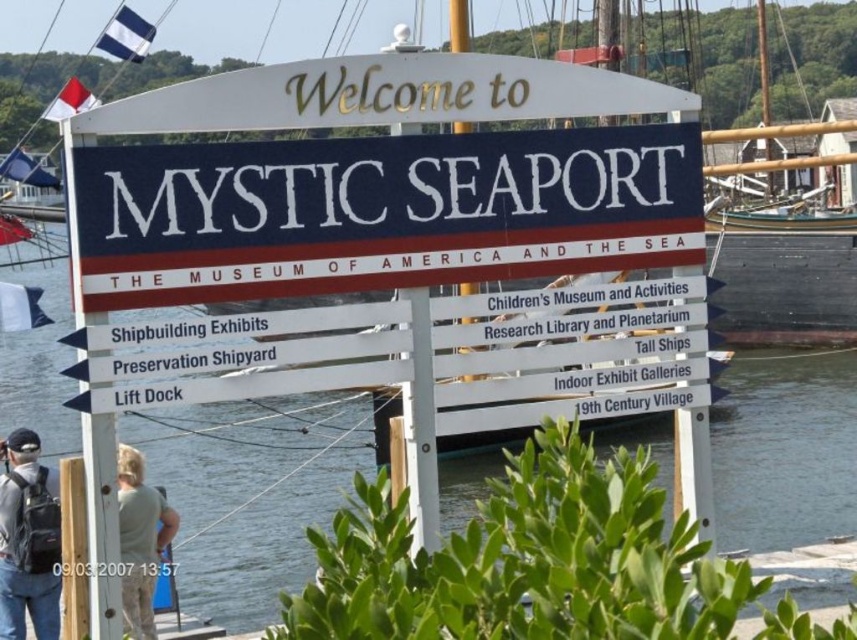
You are standing at the entrance of Mystic Seaport and want to take a photo of both the signboard and the boats. If you focus on the point at coordinates point (684, 220) first, will the point at coordinates point (46, 625) be in focus automatically?

Since point (684, 220) is further to the camera than point (46, 625), focusing on the former will not automatically keep the latter in focus because they are at different distances from the camera.

Based on the photo, you are standing at the entrance of Mystic Seaport Museum and want to locate the wooden ship at center. According to the coordinates provided, where should you look relative to the entrance?

The wooden ship at center is located at coordinates point (787,288), so you should look towards the center area of the image, slightly to the right and lower portion from the entrance perspective.

You are standing at the entrance of Mystic Seaport Museum and want to find the clear water at center. According to the coordinates provided, where should you look?

The clear water at center is located at the coordinates point (250, 492).